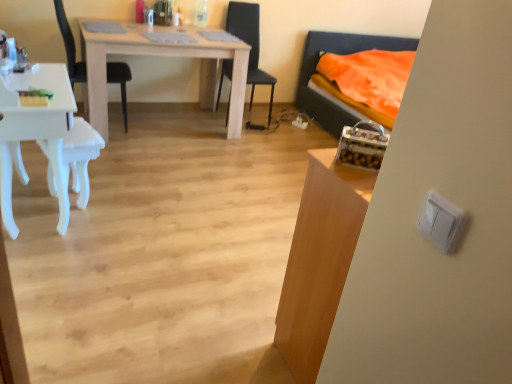
Question: In the image, is light wood table at center, arranged as the 2th table when viewed from the right, positioned in front of or behind white plastic light switch at right?

Choices:
 (A) front
 (B) behind

Answer: (B)

Question: Considering the positions of point tap(135, 38) and point tap(454, 233), is point tap(135, 38) closer or farther from the camera than point tap(454, 233)?

Choices:
 (A) farther
 (B) closer

Answer: (A)

Question: Which object is the closest to the white glossy switch at right, which ranks as the second table in left-to-right order?

Choices:
 (A) light wood table at center, the second table in the bottom-to-top sequence
 (B) white glossy desk at left
 (C) black plastic chair at upper left, the 1th chair in the left-to-right sequence
 (D) white glossy armchair at lower left
 (E) white plastic light switch at right

Answer: (E)

Question: Estimate the real-world distances between objects in this image. Which object is farther from the light wood table at center, the second table in the bottom-to-top sequence?

Choices:
 (A) white plastic light switch at right
 (B) black plastic chair at upper left, the 1th chair in the left-to-right sequence
 (C) white glossy armchair at lower left
 (D) black leather chair at center, positioned as the second chair in left-to-right order
 (E) white glossy switch at right, the second table from the top

Answer: (A)